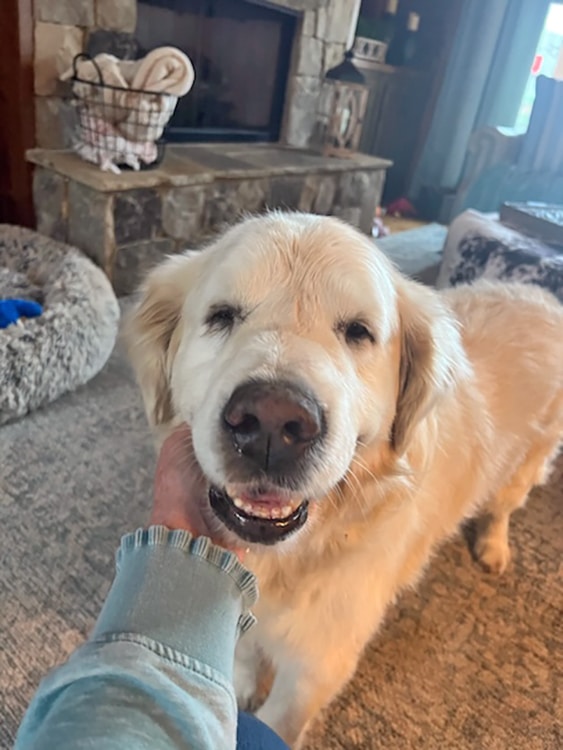
The width and height of the screenshot is (563, 750). Identify the location of floor. (97, 478).